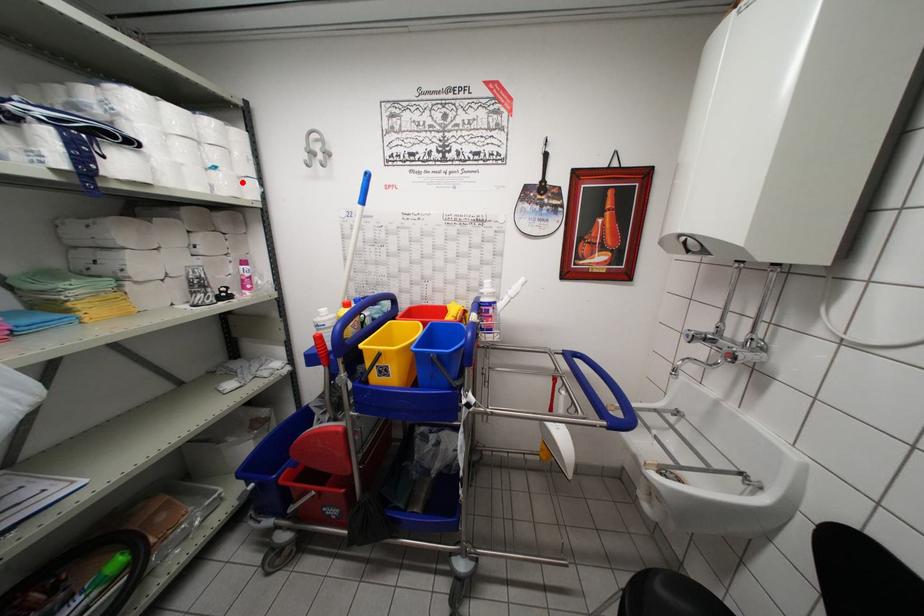
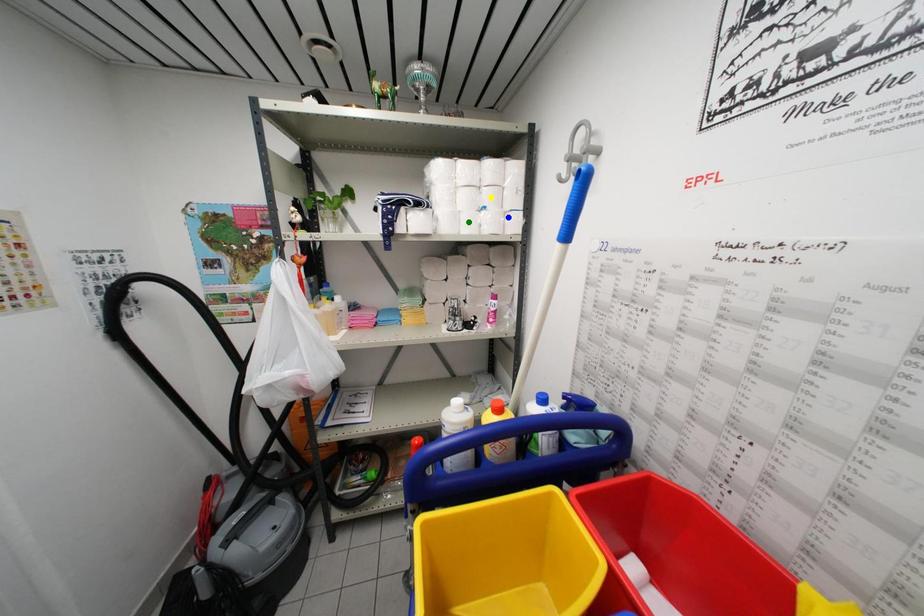
Question: I am providing you with two images of the same scene from different viewpoints. A red point is marked on the first image. You are given multiple points on the second image. Which point in image 2 represents the same 3d spot as the red point in image 1?

Choices:
 (A) blue point
 (B) green point
 (C) yellow point

Answer: (A)